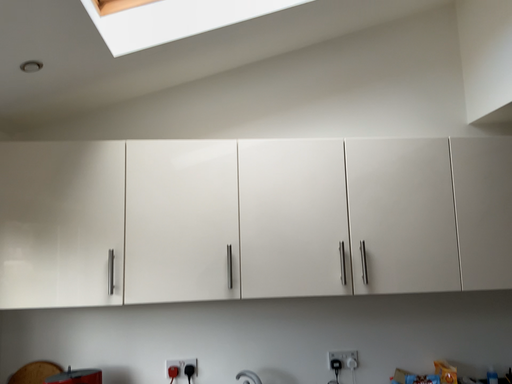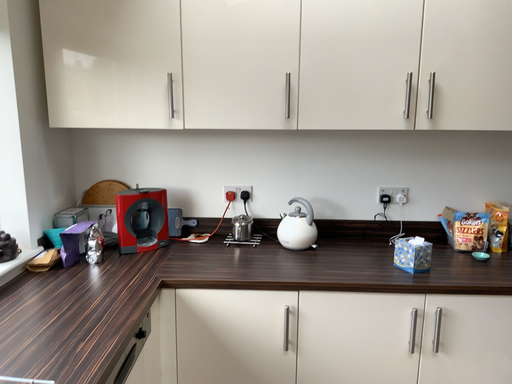
Question: How did the camera likely rotate when shooting the video?

Choices:
 (A) rotated right
 (B) rotated left

Answer: (B)